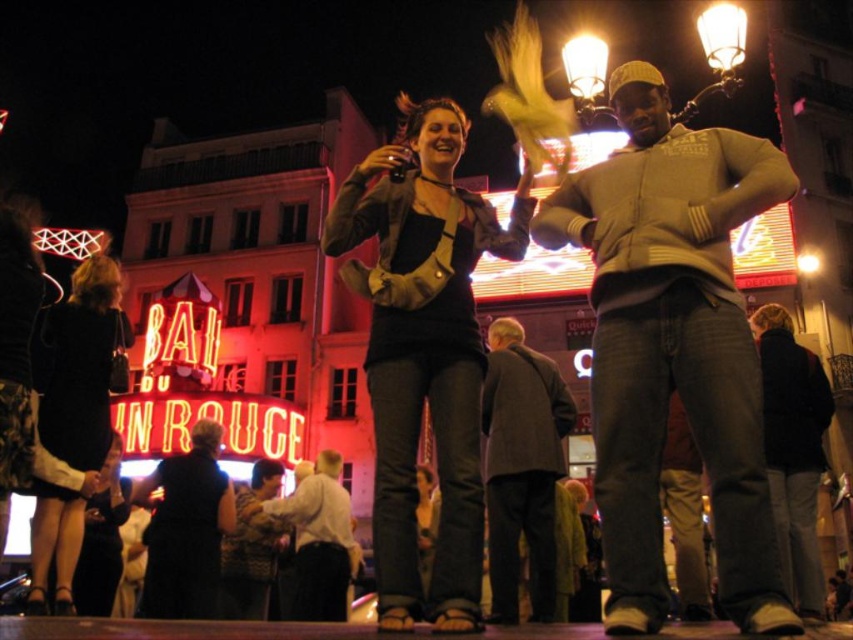
Does black fabric dress at lower left appear on the right side of gray wool coat at center?

No, black fabric dress at lower left is not to the right of gray wool coat at center.

Identify the location of black fabric dress at lower left. This screenshot has height=640, width=853. (83, 365).

Between point (56, 385) and point (511, 499), which one is positioned in front?

Point (56, 385)

Find the location of a particular element. black fabric dress at lower left is located at coordinates [x=83, y=365].

Does light beige sweater at center appear under black leather jacket at lower left?

No, light beige sweater at center is not below black leather jacket at lower left.

Between light beige sweater at center and black leather jacket at lower left, which one is positioned higher?

Positioned higher is light beige sweater at center.

The image size is (853, 640). I want to click on light beige sweater at center, so click(x=672, y=346).

Is dark gray jeans at lower right bigger than black leather jacket at lower left?

Yes.

Is dark gray jeans at lower right to the left of black leather jacket at lower left from the viewer's perspective?

No, dark gray jeans at lower right is not to the left of black leather jacket at lower left.

Does point (825, 380) come farther from viewer compared to point (108, 548)?

No, it is not.

At what (x,y) coordinates should I click in order to perform the action: click on dark gray jeans at lower right. Please return your answer as a coordinate pair (x, y). Looking at the image, I should click on (793, 451).